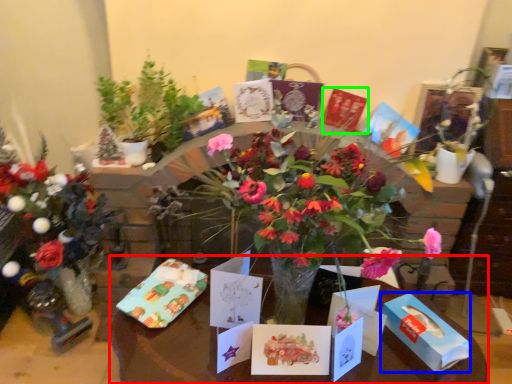
Question: Estimate the real-world distances between objects in this image. Which object is farther from table (highlighted by a red box), box (highlighted by a blue box) or birthday card (highlighted by a green box)?

Choices:
 (A) box
 (B) birthday card

Answer: (B)